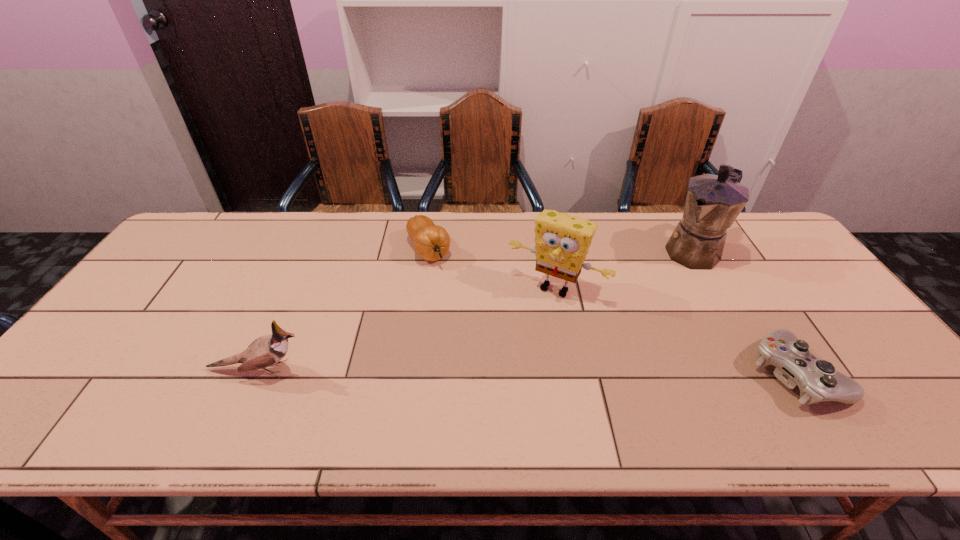
Locate an element on the screen. The image size is (960, 540). object that stands as the second closest to the sponge is located at coordinates (713, 202).